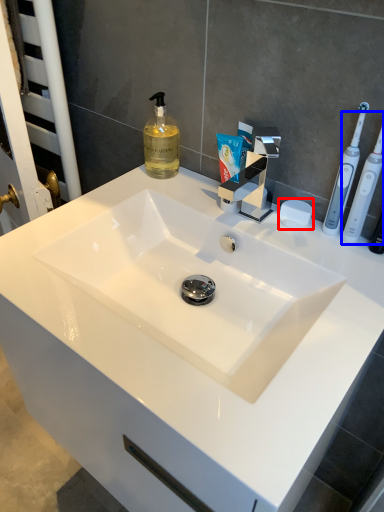
Question: Which of the following is the closest to the observer, soap (highlighted by a red box) or toothbrush (highlighted by a blue box)?

Choices:
 (A) soap
 (B) toothbrush

Answer: (B)